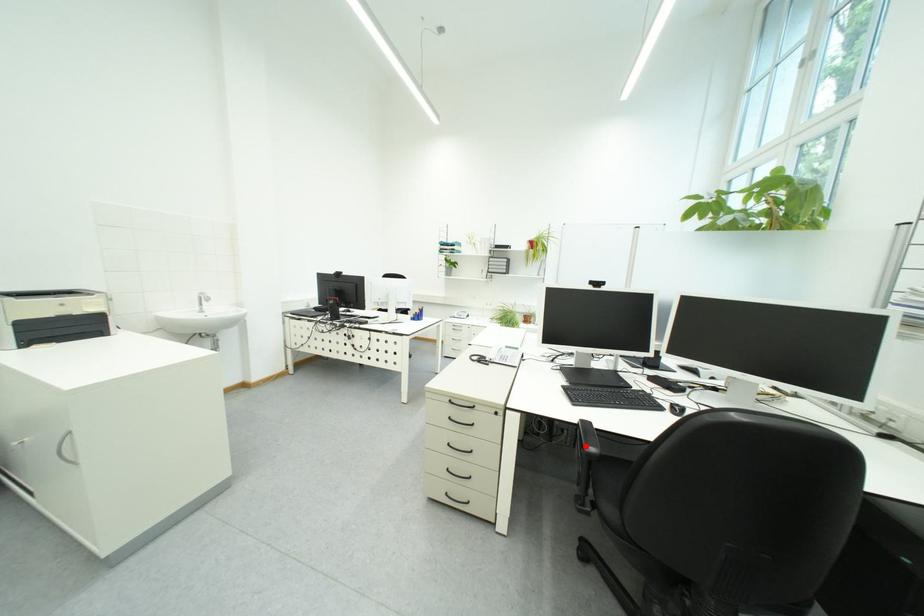
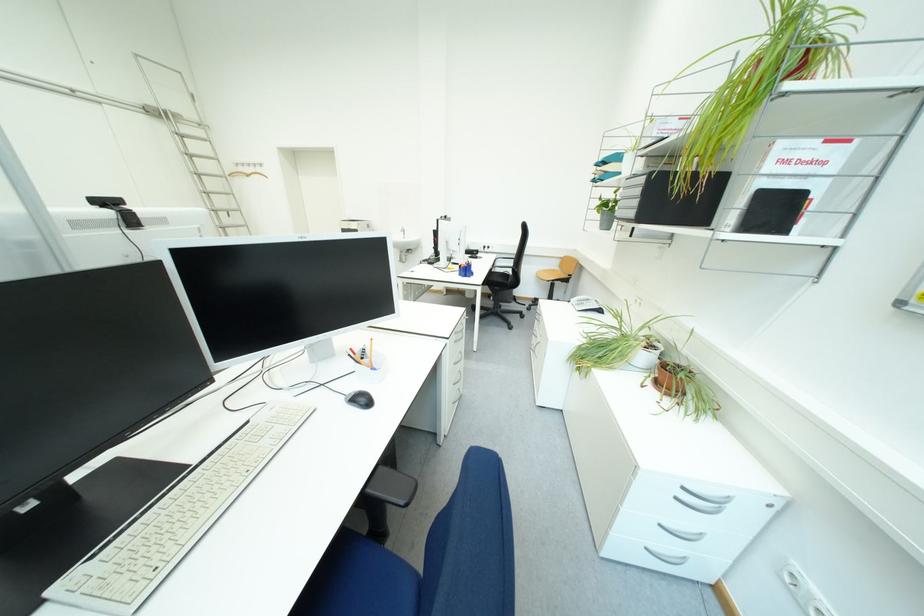
Question: I am providing you with two images of the same scene from different viewpoints. A red point is marked on the first image. Can you still see the location of the red point in image 2?

Choices:
 (A) Yes
 (B) No

Answer: (B)